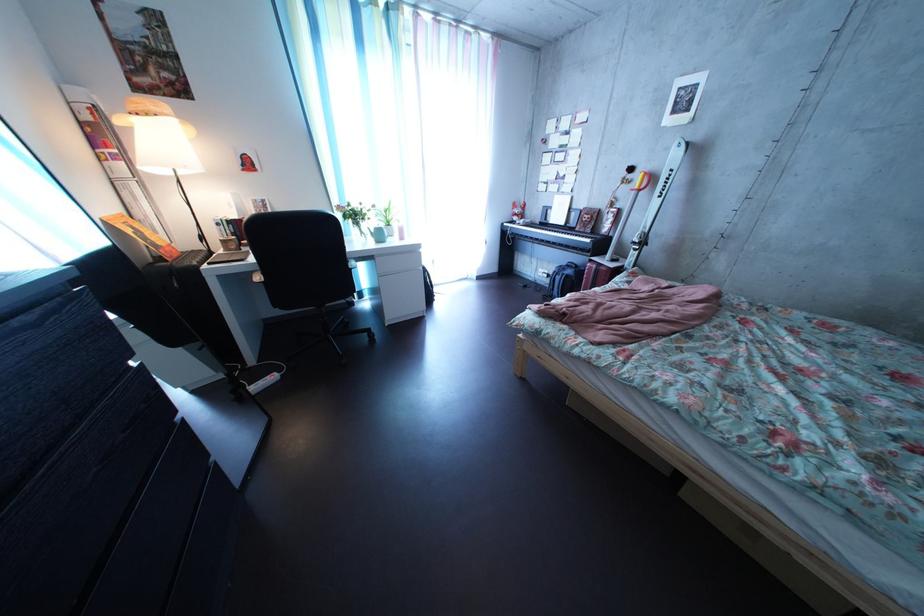
Find the location of a particular element. The height and width of the screenshot is (616, 924). white piano key is located at coordinates (560, 237).